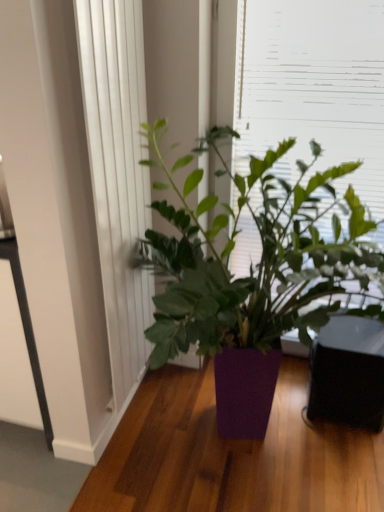
Question: Is white textured curtain at left touching purple matte plant at center?

Choices:
 (A) no
 (B) yes

Answer: (A)

Question: From a real-world perspective, is white textured curtain at left below purple matte plant at center?

Choices:
 (A) no
 (B) yes

Answer: (A)

Question: Can you confirm if white textured curtain at left is wider than purple matte plant at center?

Choices:
 (A) yes
 (B) no

Answer: (B)

Question: Is white textured curtain at left positioned in front of purple matte plant at center?

Choices:
 (A) no
 (B) yes

Answer: (A)

Question: Would you say white textured curtain at left contains purple matte plant at center?

Choices:
 (A) yes
 (B) no

Answer: (B)

Question: Is white textured curtain at left to the right of purple matte plant at center from the viewer's perspective?

Choices:
 (A) no
 (B) yes

Answer: (A)

Question: Can you confirm if white textured curtain at left is smaller than green leafy plant at upper center?

Choices:
 (A) no
 (B) yes

Answer: (B)

Question: Does white textured curtain at left appear on the right side of green leafy plant at upper center?

Choices:
 (A) no
 (B) yes

Answer: (A)

Question: From the image's perspective, would you say white textured curtain at left is positioned over green leafy plant at upper center?

Choices:
 (A) no
 (B) yes

Answer: (A)

Question: Is white textured curtain at left taller than green leafy plant at upper center?

Choices:
 (A) yes
 (B) no

Answer: (B)

Question: Is white textured curtain at left to the left of green leafy plant at upper center from the viewer's perspective?

Choices:
 (A) no
 (B) yes

Answer: (B)

Question: Does white textured curtain at left come in front of green leafy plant at upper center?

Choices:
 (A) yes
 (B) no

Answer: (A)

Question: From the image's perspective, is green leafy plant at upper center located above white textured curtain at left?

Choices:
 (A) yes
 (B) no

Answer: (A)